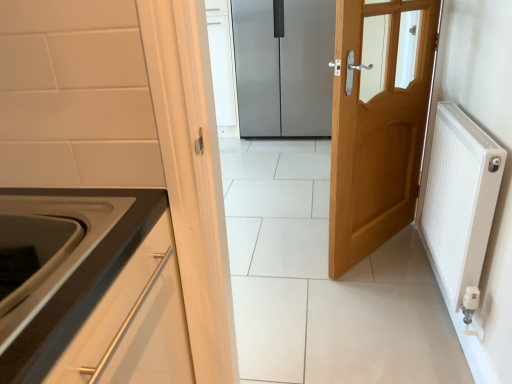
Question: Is white ribbed radiator at right taller or shorter than light wood door at center, the second door when ordered from back to front?

Choices:
 (A) short
 (B) tall

Answer: (A)

Question: Would you say white ribbed radiator at right is to the left or to the right of light wood door at center, acting as the first door starting from the front, in the picture?

Choices:
 (A) left
 (B) right

Answer: (B)

Question: Estimate the real-world distances between objects in this image. Which object is closer to the white ribbed radiator at right?

Choices:
 (A) white glossy oven at lower left
 (B) satin silver refrigerator at center, which appears as the 2th door when viewed from the front
 (C) light wood door at center, the second door when ordered from back to front

Answer: (C)

Question: Which of these objects is positioned farthest from the white glossy oven at lower left?

Choices:
 (A) light wood door at center, acting as the first door starting from the front
 (B) white ribbed radiator at right
 (C) satin silver refrigerator at center, which appears as the 2th door when viewed from the front

Answer: (C)